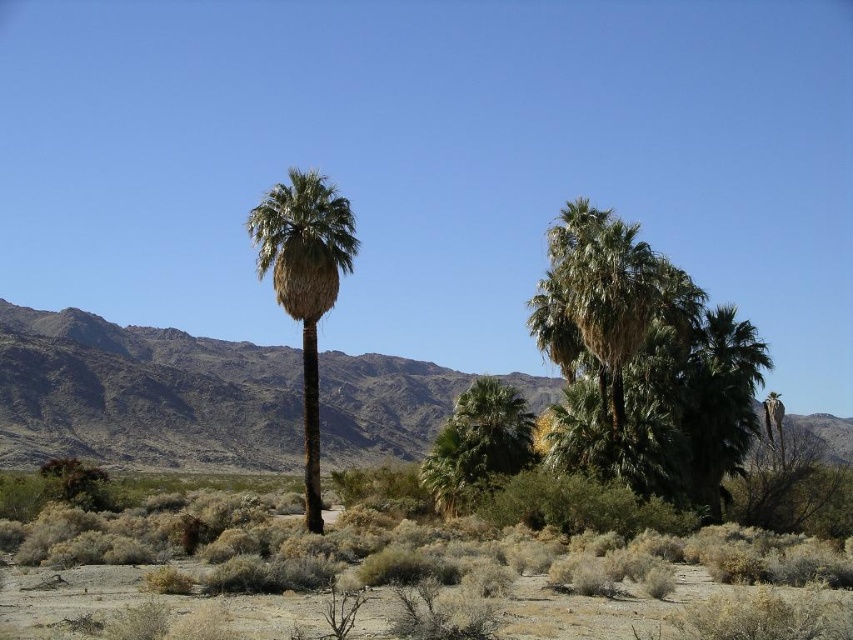
In the scene shown: You are standing in the desert and see the dry shrubbery at lower center and the green leafy palm at center. Which object is closer to you?

The dry shrubbery at lower center is closer to you because it is positioned in front of the green leafy palm at center.

You are a hiker trying to find shade in the desert. You see the dry shrubbery at lower center and the green leafy palm at center. Which of these two would provide better shade?

The green leafy palm at center is taller than the dry shrubbery at lower center, so it would provide better shade.

Looking at this image, you are planning to set up a small campsite between the green leafy palm tree at center and the green leafy palm at center. The campsite requires a minimum of 50 feet of space between the two trees. Based on the description, is the distance sufficient?

The distance between the green leafy palm tree at center and the green leafy palm at center is 46.13 feet, which is less than the required 50 feet. Therefore, the space is insufficient for the campsite.